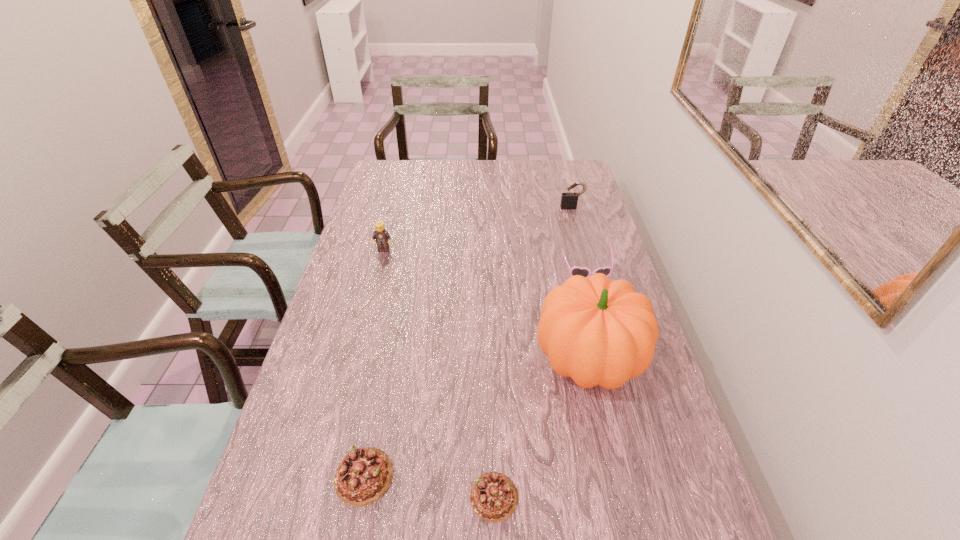
The image size is (960, 540). What are the coordinates of `blank space located 0.110m with the keyhole on the front of the farthest object` in the screenshot? It's located at (577, 226).

Where is `vacant space located 0.270m on the front-facing side of the fourth nearest object`? The width and height of the screenshot is (960, 540). vacant space located 0.270m on the front-facing side of the fourth nearest object is located at coordinates (609, 352).

Where is `free space located in front of the second farthest object`? This screenshot has height=540, width=960. free space located in front of the second farthest object is located at coordinates (361, 336).

Locate an element on the screen. This screenshot has width=960, height=540. vacant space located on the back of the pumpkin is located at coordinates (568, 274).

This screenshot has height=540, width=960. I want to click on chocolate cake that is at the left edge, so click(x=363, y=476).

Where is `Lego present at the left edge`? The width and height of the screenshot is (960, 540). Lego present at the left edge is located at coordinates pyautogui.click(x=382, y=237).

Locate an element on the screen. The height and width of the screenshot is (540, 960). padlock positioned at the right edge is located at coordinates (569, 200).

This screenshot has width=960, height=540. I want to click on sunglasses that is at the right edge, so click(586, 272).

This screenshot has height=540, width=960. I want to click on pumpkin at the right edge, so click(x=597, y=331).

The image size is (960, 540). What are the coordinates of `object that is at the near left corner` in the screenshot? It's located at (363, 476).